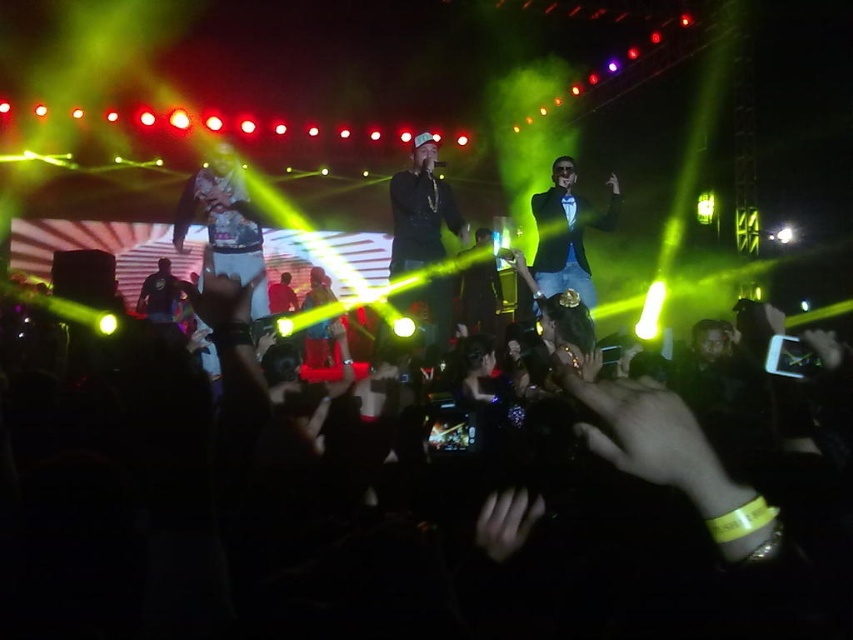
Where is `black fabric crowd at lower center`? This screenshot has width=853, height=640. black fabric crowd at lower center is located at coordinates (514, 518).

Measure the distance between black fabric crowd at lower center and black leather jacket at center.

A distance of 3.32 meters exists between black fabric crowd at lower center and black leather jacket at center.

The width and height of the screenshot is (853, 640). What do you see at coordinates (514, 518) in the screenshot? I see `black fabric crowd at lower center` at bounding box center [514, 518].

Where is `black fabric crowd at lower center`? This screenshot has width=853, height=640. black fabric crowd at lower center is located at coordinates (514, 518).

At what (x,y) coordinates should I click in order to perform the action: click on black fabric crowd at lower center. Please return your answer as a coordinate pair (x, y). This screenshot has height=640, width=853. Looking at the image, I should click on (514, 518).

Which is behind, point (421, 218) or point (552, 252)?

Point (552, 252)

The width and height of the screenshot is (853, 640). Describe the element at coordinates (421, 211) in the screenshot. I see `black leather jacket at center` at that location.

Does point (430, 221) lie in front of point (592, 298)?

Yes, point (430, 221) is in front of point (592, 298).

The height and width of the screenshot is (640, 853). I want to click on black leather jacket at center, so click(421, 211).